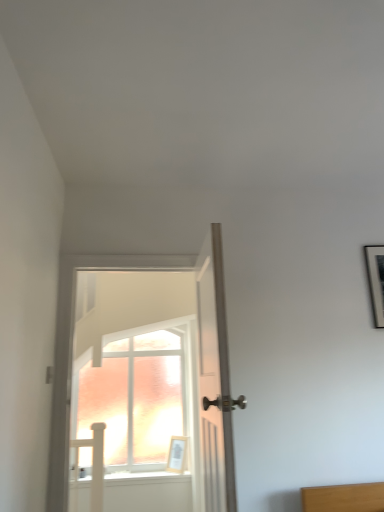
Where is `light wood picture frame at center`? This screenshot has width=384, height=512. light wood picture frame at center is located at coordinates (177, 454).

This screenshot has width=384, height=512. Describe the element at coordinates (126, 365) in the screenshot. I see `white glossy door at center, the second door when ordered from right to left` at that location.

Where is `white wooden door at center, which is the 1th door from right to left`? Image resolution: width=384 pixels, height=512 pixels. white wooden door at center, which is the 1th door from right to left is located at coordinates (215, 378).

Is point (226, 319) positioned before point (87, 321)?

Yes, point (226, 319) is closer to viewer.

Does white wooden door at center, the second door positioned from the left, have a greater width compared to white glossy door at center, the second door when ordered from right to left?

In fact, white wooden door at center, the second door positioned from the left, might be narrower than white glossy door at center, the second door when ordered from right to left.

In the scene shown: How many degrees apart are the facing directions of white wooden door at center, the second door positioned from the left, and white glossy door at center, acting as the 1th door starting from the left?

There is a 89.2-degree angle between the facing directions of white wooden door at center, the second door positioned from the left, and white glossy door at center, acting as the 1th door starting from the left.

Is light wood picture frame at center completely or partially outside of white wooden door at center, the second door positioned from the left?

light wood picture frame at center lies outside white wooden door at center, the second door positioned from the left,'s area.

Could you tell me if light wood picture frame at center is facing white wooden door at center, the second door positioned from the left?

No, light wood picture frame at center is not aimed at white wooden door at center, the second door positioned from the left.

From the image's perspective, is light wood picture frame at center below white wooden door at center, the second door positioned from the left?

Indeed, from the image's perspective, light wood picture frame at center is shown beneath white wooden door at center, the second door positioned from the left.

Where is `picture frame located on the left of white wooden door at center, which is the 1th door from right to left`? Image resolution: width=384 pixels, height=512 pixels. picture frame located on the left of white wooden door at center, which is the 1th door from right to left is located at coordinates (177, 454).

Can you tell me how much white glossy door at center, the second door when ordered from right to left, and white wooden door at center, which is the 1th door from right to left, differ in facing direction?

There is a 89.2-degree angle between the facing directions of white glossy door at center, the second door when ordered from right to left, and white wooden door at center, which is the 1th door from right to left.

Is white glossy door at center, acting as the 1th door starting from the left, oriented away from white wooden door at center, which is the 1th door from right to left?

white glossy door at center, acting as the 1th door starting from the left, does not have its back to white wooden door at center, which is the 1th door from right to left.

Based on the photo, how much distance is there between white glossy door at center, the second door when ordered from right to left, and white wooden door at center, which is the 1th door from right to left?

The distance of white glossy door at center, the second door when ordered from right to left, from white wooden door at center, which is the 1th door from right to left, is 3.21 meters.

Is white wooden door at center, the second door positioned from the left, at the right side of light wood picture frame at center?

Yes.

How much distance is there between white wooden door at center, the second door positioned from the left, and light wood picture frame at center?

white wooden door at center, the second door positioned from the left, is 2.76 meters from light wood picture frame at center.

Can we say white wooden door at center, which is the 1th door from right to left, lies outside light wood picture frame at center?

white wooden door at center, which is the 1th door from right to left, lies outside light wood picture frame at center's area.

In the scene shown: Is white wooden door at center, which is the 1th door from right to left, placed right next to light wood picture frame at center?

white wooden door at center, which is the 1th door from right to left, and light wood picture frame at center are not in contact.

Is white glossy door at center, the second door when ordered from right to left, positioned far away from light wood picture frame at center?

No, there isn't a large distance between white glossy door at center, the second door when ordered from right to left, and light wood picture frame at center.

Is point (206, 506) closer to viewer compared to point (173, 457)?

Yes, point (206, 506) is in front of point (173, 457).

Considering the relative sizes of white glossy door at center, the second door when ordered from right to left, and light wood picture frame at center in the image provided, is white glossy door at center, the second door when ordered from right to left, bigger than light wood picture frame at center?

Indeed, white glossy door at center, the second door when ordered from right to left, has a larger size compared to light wood picture frame at center.

Could you tell me if white glossy door at center, the second door when ordered from right to left, is facing light wood picture frame at center?

No, white glossy door at center, the second door when ordered from right to left, is not oriented towards light wood picture frame at center.

Who is more distant, light wood picture frame at center or white glossy door at center, acting as the 1th door starting from the left?

Positioned behind is light wood picture frame at center.

Is white glossy door at center, the second door when ordered from right to left, inside light wood picture frame at center?

Actually, white glossy door at center, the second door when ordered from right to left, is outside light wood picture frame at center.

From the image's perspective, relative to white glossy door at center, the second door when ordered from right to left, is light wood picture frame at center above or below?

light wood picture frame at center is situated lower than white glossy door at center, the second door when ordered from right to left, in the image.

Does light wood picture frame at center have a smaller size compared to white glossy door at center, the second door when ordered from right to left?

Correct, light wood picture frame at center occupies less space than white glossy door at center, the second door when ordered from right to left.

Find the location of a particular element. door behind the white wooden door at center, which is the 1th door from right to left is located at coordinates 126,365.

Where is `picture frame located below the white wooden door at center, which is the 1th door from right to left (from the image's perspective)`? The width and height of the screenshot is (384, 512). picture frame located below the white wooden door at center, which is the 1th door from right to left (from the image's perspective) is located at coordinates (177, 454).

Looking at this image, considering their positions, is light wood picture frame at center positioned further to white glossy door at center, the second door when ordered from right to left, than white wooden door at center, which is the 1th door from right to left?

white wooden door at center, which is the 1th door from right to left.

When comparing their distances from light wood picture frame at center, does white wooden door at center, the second door positioned from the left, or white glossy door at center, the second door when ordered from right to left, seem further?

Based on the image, white wooden door at center, the second door positioned from the left, appears to be further to light wood picture frame at center.

Which object lies further to the anchor point light wood picture frame at center, white glossy door at center, acting as the 1th door starting from the left, or white wooden door at center, the second door positioned from the left?

white wooden door at center, the second door positioned from the left, is positioned further to the anchor light wood picture frame at center.

Looking at the image, which one is located further to white wooden door at center, which is the 1th door from right to left, white glossy door at center, the second door when ordered from right to left, or light wood picture frame at center?

Among the two, white glossy door at center, the second door when ordered from right to left, is located further to white wooden door at center, which is the 1th door from right to left.

Based on their spatial positions, is light wood picture frame at center or white glossy door at center, acting as the 1th door starting from the left, closer to white wooden door at center, which is the 1th door from right to left?

light wood picture frame at center is closer to white wooden door at center, which is the 1th door from right to left.

Based on their spatial positions, is white wooden door at center, the second door positioned from the left, or light wood picture frame at center further from white glossy door at center, the second door when ordered from right to left?

The object further to white glossy door at center, the second door when ordered from right to left, is white wooden door at center, the second door positioned from the left.

Where is `door between white wooden door at center, the second door positioned from the left, and light wood picture frame at center, along the z-axis`? The height and width of the screenshot is (512, 384). door between white wooden door at center, the second door positioned from the left, and light wood picture frame at center, along the z-axis is located at coordinates (126, 365).